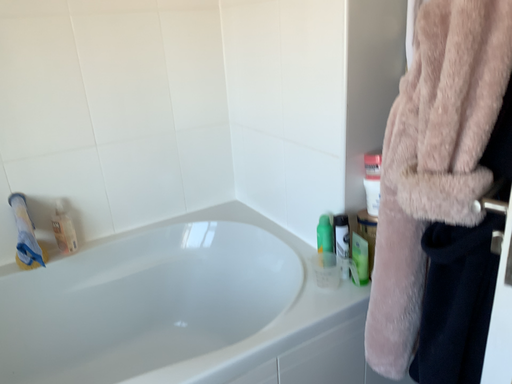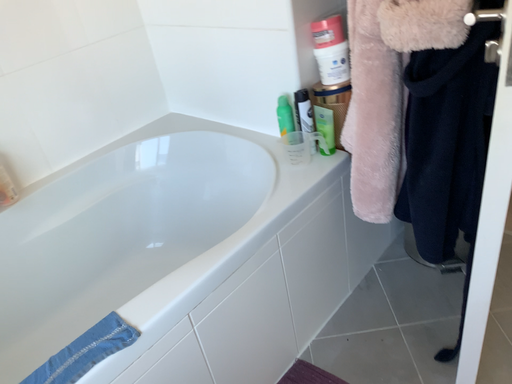
Question: How did the camera likely rotate when shooting the video?

Choices:
 (A) rotated right
 (B) rotated left

Answer: (A)